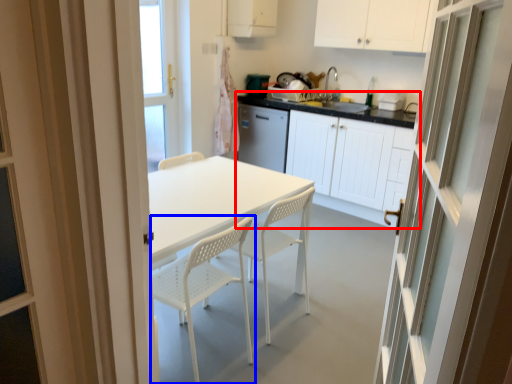
Question: Among these objects, which one is nearest to the camera, cabinetry (highlighted by a red box) or chair (highlighted by a blue box)?

Choices:
 (A) cabinetry
 (B) chair

Answer: (B)